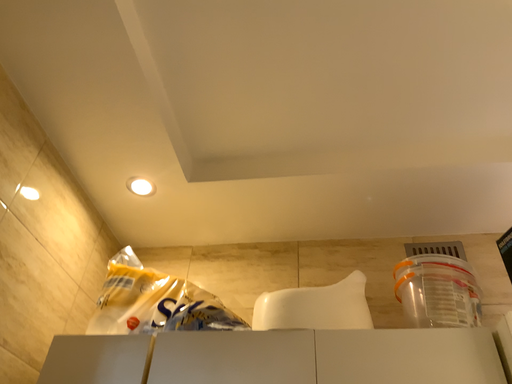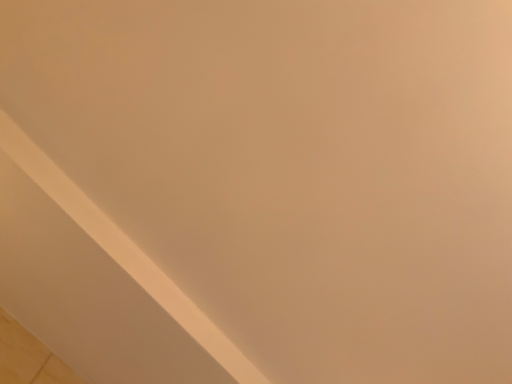
Question: Which way did the camera rotate in the video?

Choices:
 (A) rotated upward
 (B) rotated downward

Answer: (A)